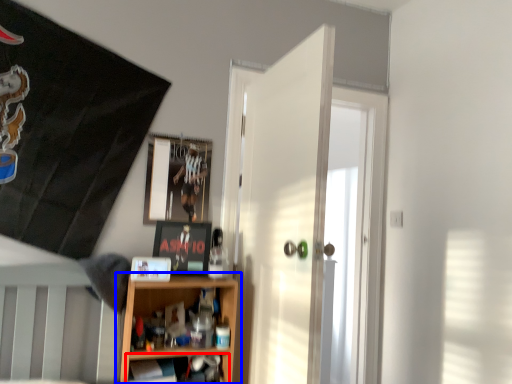
Question: Which object is closer to the camera taking this photo, shelf (highlighted by a red box) or shelf (highlighted by a blue box)?

Choices:
 (A) shelf
 (B) shelf

Answer: (A)